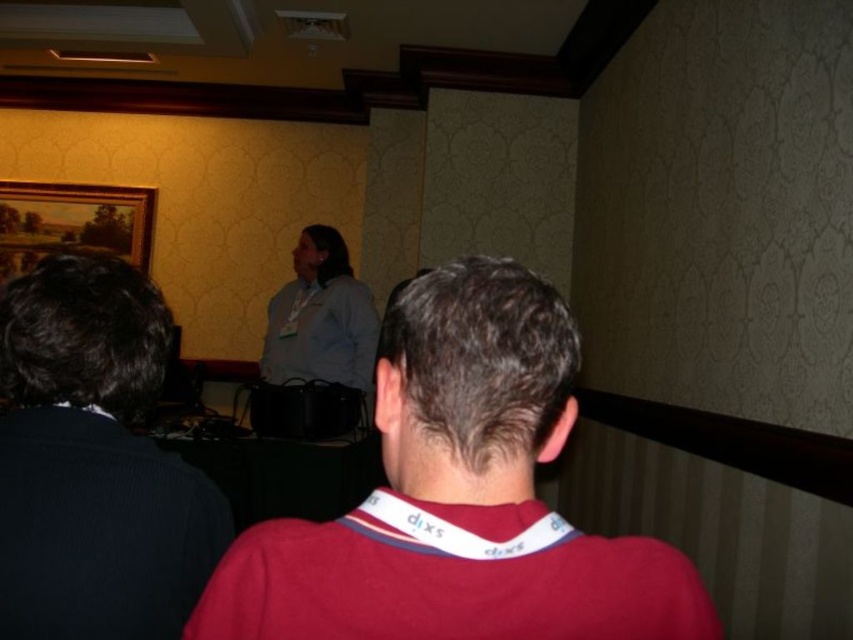
Question: Does dark blue sweater at left have a larger size compared to wooden oil painting at upper left?

Choices:
 (A) no
 (B) yes

Answer: (A)

Question: Can you confirm if red cotton shirt at center is positioned above dark blue sweater at left?

Choices:
 (A) no
 (B) yes

Answer: (A)

Question: Which point is farther to the camera?

Choices:
 (A) light blue shirt at center
 (B) red cotton shirt at center
 (C) dark blue sweater at left

Answer: (A)

Question: Which point is closer to the camera?

Choices:
 (A) red cotton shirt at center
 (B) light blue shirt at center

Answer: (A)

Question: Does red cotton shirt at center have a greater width compared to wooden oil painting at upper left?

Choices:
 (A) no
 (B) yes

Answer: (A)

Question: Which object is farther from the camera taking this photo?

Choices:
 (A) dark blue sweater at left
 (B) wooden oil painting at upper left

Answer: (B)